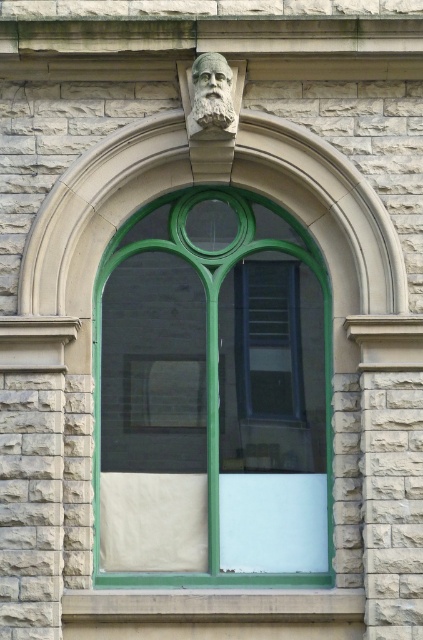
Can you confirm if stone carved bust at upper center is positioned to the left of white stone face at upper center?

Incorrect, stone carved bust at upper center is not on the left side of white stone face at upper center.

How far apart are stone carved bust at upper center and white stone face at upper center?

2.19 inches

Identify the location of stone carved bust at upper center. (209, 97).

This screenshot has width=423, height=640. What are the coordinates of `stone carved bust at upper center` in the screenshot? It's located at (209, 97).

This screenshot has width=423, height=640. Identify the location of green glass window at center. (213, 396).

Is green glass window at center positioned at the back of smooth concrete window sill at center?

Yes, it is.

Is point (192, 561) behind point (230, 595)?

Yes, it is behind point (230, 595).

I want to click on green glass window at center, so 213,396.

Can you confirm if smooth concrete window sill at center is positioned to the left of stone carved bust at upper center?

Yes, smooth concrete window sill at center is to the left of stone carved bust at upper center.

Can you confirm if smooth concrete window sill at center is bigger than stone carved bust at upper center?

Correct, smooth concrete window sill at center is larger in size than stone carved bust at upper center.

I want to click on smooth concrete window sill at center, so click(213, 604).